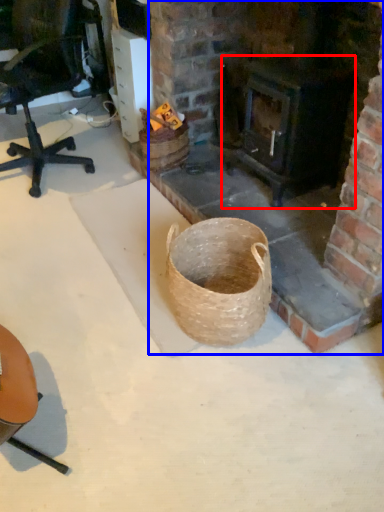
Question: Which of the following is the farthest to the observer, stove (highlighted by a red box) or fireplace (highlighted by a blue box)?

Choices:
 (A) stove
 (B) fireplace

Answer: (A)